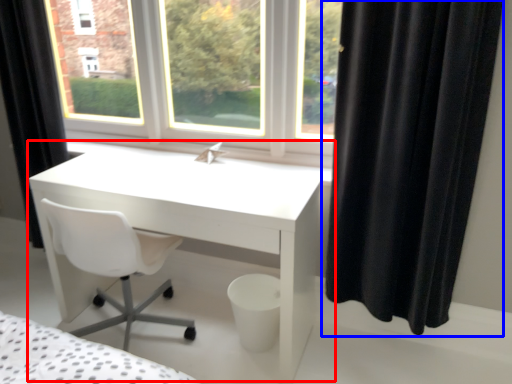
Question: Which object appears closest to the camera in this image, table (highlighted by a red box) or curtain (highlighted by a blue box)?

Choices:
 (A) table
 (B) curtain

Answer: (B)